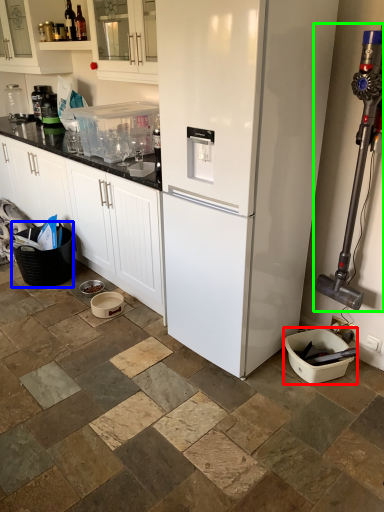
Question: Which object is positioned closest to appliance (highlighted by a red box)? Select from basket (highlighted by a blue box) and appliance (highlighted by a green box).

Choices:
 (A) basket
 (B) appliance

Answer: (B)